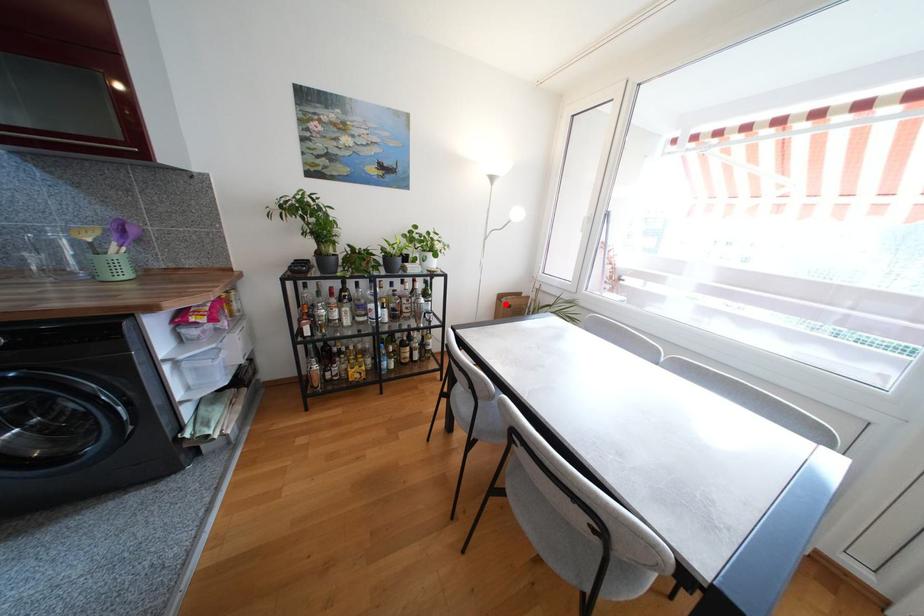
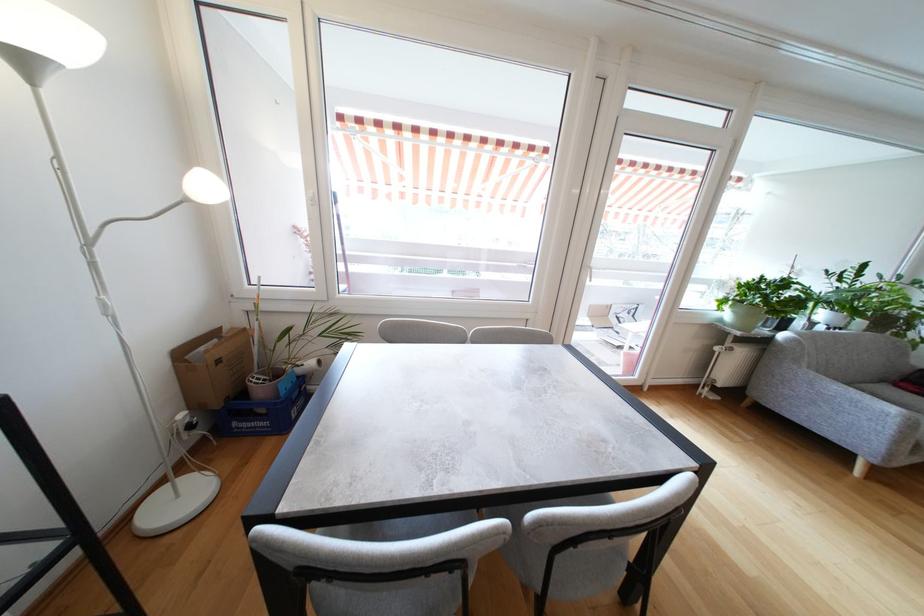
Locate, in the second image, the point that corresponds to the highlighted location in the first image.

(191, 363)